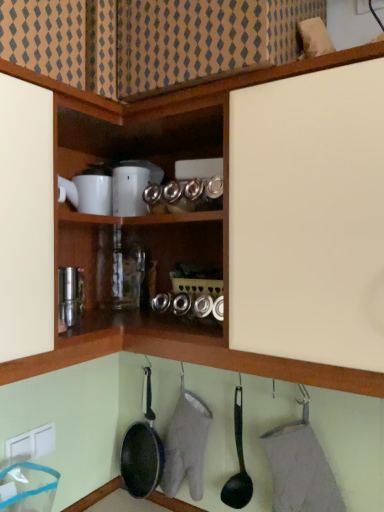
Question: Is white glossy coffee maker at upper center at the left side of black plastic frying pan at lower center, placed as the first frying pan when sorted from right to left?

Choices:
 (A) no
 (B) yes

Answer: (B)

Question: From the image's perspective, is white glossy coffee maker at upper center located above black plastic frying pan at lower center, placed as the 1th frying pan when sorted from front to back?

Choices:
 (A) no
 (B) yes

Answer: (B)

Question: Is white glossy coffee maker at upper center looking in the opposite direction of black plastic frying pan at lower center, placed as the 1th frying pan when sorted from front to back?

Choices:
 (A) yes
 (B) no

Answer: (B)

Question: From a real-world perspective, is white glossy coffee maker at upper center on black plastic frying pan at lower center, placed as the first frying pan when sorted from right to left?

Choices:
 (A) no
 (B) yes

Answer: (B)

Question: Considering the relative positions of white glossy coffee maker at upper center and black plastic frying pan at lower center, placed as the first frying pan when sorted from right to left, in the image provided, is white glossy coffee maker at upper center behind black plastic frying pan at lower center, placed as the first frying pan when sorted from right to left,?

Choices:
 (A) yes
 (B) no

Answer: (A)

Question: Is white plastic electric outlet at lower left bigger or smaller than black non-stick frying pan at lower center, which is counted as the first frying pan, starting from the back?

Choices:
 (A) big
 (B) small

Answer: (B)

Question: Does point (46, 442) appear closer or farther from the camera than point (122, 476)?

Choices:
 (A) farther
 (B) closer

Answer: (B)

Question: Based on their positions, is white plastic electric outlet at lower left located to the left or right of black non-stick frying pan at lower center, which ranks as the 1th frying pan in left-to-right order?

Choices:
 (A) left
 (B) right

Answer: (A)

Question: Relative to black non-stick frying pan at lower center, the 2th frying pan viewed from the front, is white plastic electric outlet at lower left in front or behind?

Choices:
 (A) behind
 (B) front

Answer: (B)

Question: Considering the positions of white glossy coffee maker at upper center and black non-stick frying pan at lower center, which is counted as the first frying pan, starting from the back, in the image, is white glossy coffee maker at upper center taller or shorter than black non-stick frying pan at lower center, which is counted as the first frying pan, starting from the back,?

Choices:
 (A) short
 (B) tall

Answer: (A)

Question: Considering the positions of point (122, 176) and point (124, 446), is point (122, 176) closer or farther from the camera than point (124, 446)?

Choices:
 (A) farther
 (B) closer

Answer: (B)

Question: From the image's perspective, is white glossy coffee maker at upper center located above or below black non-stick frying pan at lower center, arranged as the 2th frying pan when viewed from the right?

Choices:
 (A) above
 (B) below

Answer: (A)

Question: In terms of width, does white glossy coffee maker at upper center look wider or thinner when compared to black non-stick frying pan at lower center, which ranks as the 1th frying pan in left-to-right order?

Choices:
 (A) wide
 (B) thin

Answer: (B)

Question: In the image, is black plastic frying pan at lower center, placed as the first frying pan when sorted from right to left, on the left side or the right side of black non-stick frying pan at lower center, arranged as the 2th frying pan when viewed from the right?

Choices:
 (A) left
 (B) right

Answer: (B)

Question: From a real-world perspective, is black plastic frying pan at lower center, the second frying pan positioned from the left, above or below black non-stick frying pan at lower center, the 2th frying pan viewed from the front?

Choices:
 (A) below
 (B) above

Answer: (B)